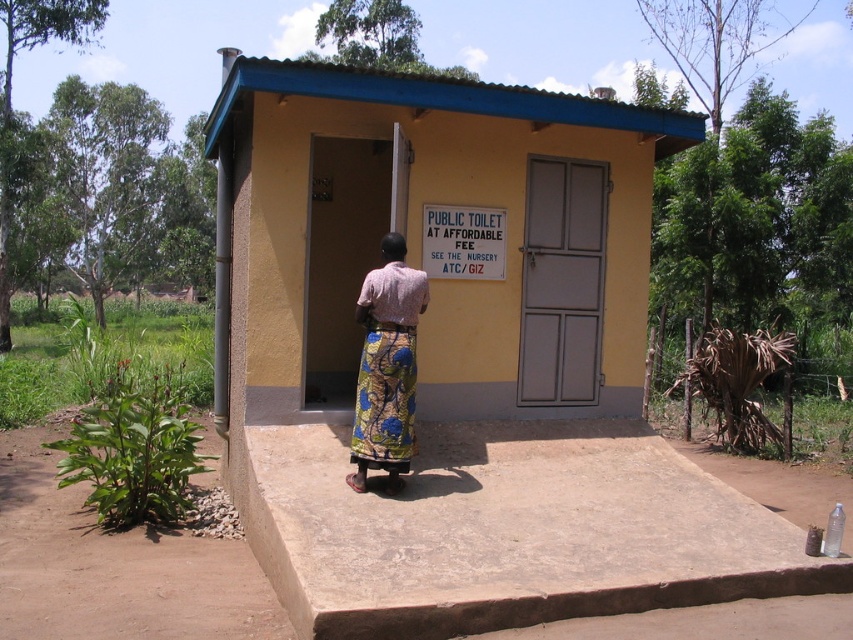
Question: Which object is closer to the camera taking this photo?

Choices:
 (A) yellow matte public toilet at center
 (B) white plastic sign at upper center
 (C) printed fabric skirt at center

Answer: (C)

Question: Does yellow matte public toilet at center have a greater width compared to white plastic sign at upper center?

Choices:
 (A) no
 (B) yes

Answer: (B)

Question: Is yellow matte public toilet at center closer to camera compared to white plastic sign at upper center?

Choices:
 (A) no
 (B) yes

Answer: (B)

Question: Is the position of printed fabric skirt at center more distant than that of white plastic sign at upper center?

Choices:
 (A) yes
 (B) no

Answer: (B)

Question: Which object is positioned farthest from the printed fabric skirt at center?

Choices:
 (A) white plastic sign at upper center
 (B) yellow matte public toilet at center

Answer: (B)

Question: Which of these objects is positioned farthest from the yellow matte public toilet at center?

Choices:
 (A) white plastic sign at upper center
 (B) printed fabric skirt at center

Answer: (B)